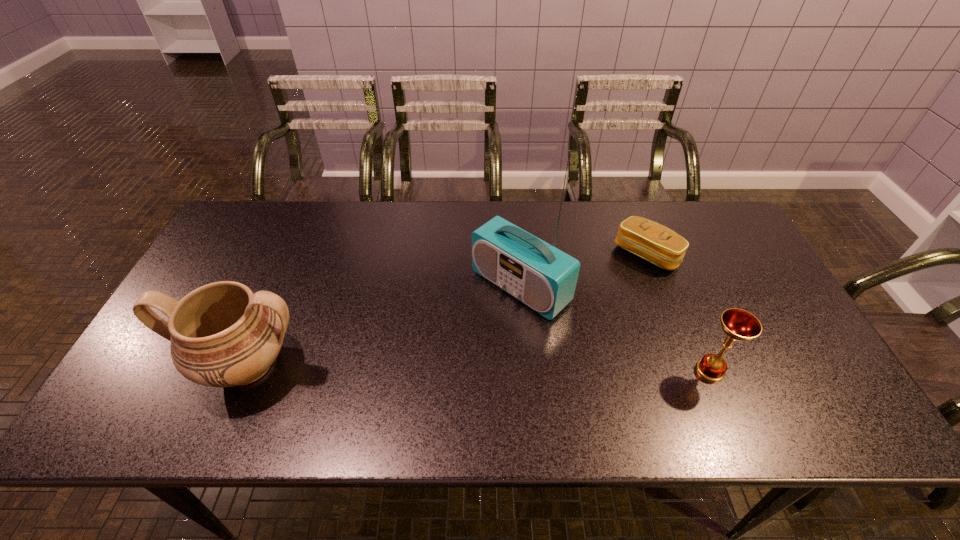
Where is `vacant spot on the desktop that is between the leftmost object and the second shortest object and is positioned on the front panel of the second object from left to right`? The width and height of the screenshot is (960, 540). vacant spot on the desktop that is between the leftmost object and the second shortest object and is positioned on the front panel of the second object from left to right is located at coordinates tap(427, 367).

I want to click on free space on the desktop that is between the urn and the chalice and is positioned on the zipper side of the clutch bag, so click(513, 368).